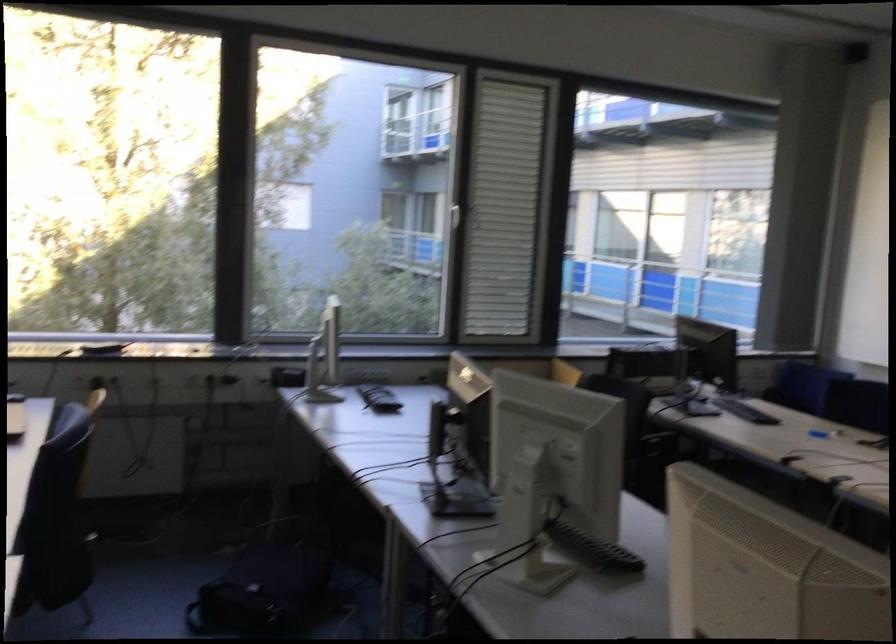
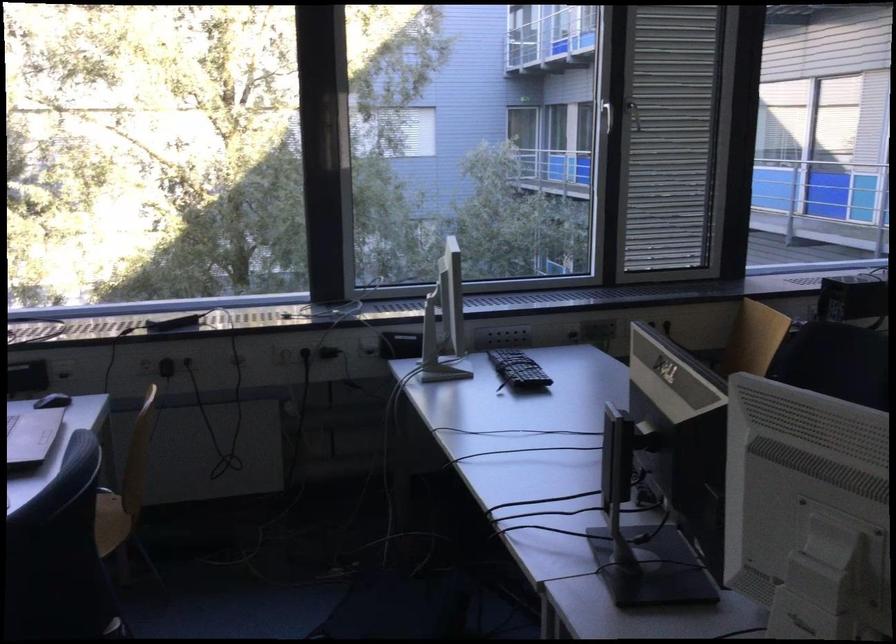
In the second image, find the point that corresponds to (74,375) in the first image.

(144, 365)